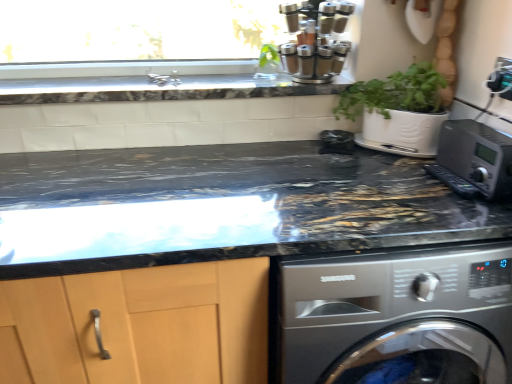
Describe the element at coordinates (315, 40) in the screenshot. The width and height of the screenshot is (512, 384). I see `satin silver spice rack at upper center` at that location.

Describe the element at coordinates (223, 206) in the screenshot. The height and width of the screenshot is (384, 512). I see `marble at center, positioned as the first countertop in bottom-to-top order` at that location.

At what (x,y) coordinates should I click in order to perform the action: click on black marble countertop at upper center, which is the first countertop from top to bottom. Please return your answer as a coordinate pair (x, y). Looking at the image, I should click on (156, 89).

In terms of width, does metallic silver microwave at right look wider or thinner when compared to black marble countertop at upper center, which is the first countertop from top to bottom?

Clearly, metallic silver microwave at right has less width compared to black marble countertop at upper center, which is the first countertop from top to bottom.

At what (x,y) coordinates should I click in order to perform the action: click on home appliance that is below the black marble countertop at upper center, which is the first countertop from top to bottom (from the image's perspective). Please return your answer as a coordinate pair (x, y). Looking at the image, I should click on (474, 160).

Considering the relative sizes of metallic silver microwave at right and black marble countertop at upper center, marked as the 2th countertop in a bottom-to-top arrangement, in the image provided, is metallic silver microwave at right bigger than black marble countertop at upper center, marked as the 2th countertop in a bottom-to-top arrangement,?

No.

Looking at their sizes, would you say marble at center, which is the 2th countertop in top-to-bottom order, is wider or thinner than black marble countertop at upper center, marked as the 2th countertop in a bottom-to-top arrangement?

In the image, marble at center, which is the 2th countertop in top-to-bottom order, appears to be wider than black marble countertop at upper center, marked as the 2th countertop in a bottom-to-top arrangement.

Could you tell me if marble at center, positioned as the first countertop in bottom-to-top order, is facing black marble countertop at upper center, marked as the 2th countertop in a bottom-to-top arrangement?

No, marble at center, positioned as the first countertop in bottom-to-top order, is not turned towards black marble countertop at upper center, marked as the 2th countertop in a bottom-to-top arrangement.

Looking at the image, does marble at center, positioned as the first countertop in bottom-to-top order, seem bigger or smaller compared to black marble countertop at upper center, which is the first countertop from top to bottom?

Considering their sizes, marble at center, positioned as the first countertop in bottom-to-top order, takes up more space than black marble countertop at upper center, which is the first countertop from top to bottom.

Considering the positions of point (499, 218) and point (20, 98), is point (499, 218) closer or farther from the camera than point (20, 98)?

Point (499, 218).

Is marble at center, which is the 2th countertop in top-to-bottom order, to the right of satin silver spice rack at upper center from the viewer's perspective?

No.

Is marble at center, positioned as the first countertop in bottom-to-top order, oriented towards satin silver spice rack at upper center?

No, marble at center, positioned as the first countertop in bottom-to-top order, is not turned towards satin silver spice rack at upper center.

Which is less distant, (x=230, y=166) or (x=301, y=36)?

Point (x=230, y=166)

Is marble at center, positioned as the first countertop in bottom-to-top order, bigger than satin silver spice rack at upper center?

Yes, marble at center, positioned as the first countertop in bottom-to-top order, is bigger than satin silver spice rack at upper center.

Between metallic silver microwave at right and marble at center, positioned as the first countertop in bottom-to-top order, which one is positioned in front?

marble at center, positioned as the first countertop in bottom-to-top order.

From the image's perspective, would you say metallic silver microwave at right is positioned over marble at center, positioned as the first countertop in bottom-to-top order?

Yes, from the image's perspective, metallic silver microwave at right is over marble at center, positioned as the first countertop in bottom-to-top order.

Considering the points (490, 195) and (297, 197), which point is behind, point (490, 195) or point (297, 197)?

The point (297, 197) is more distant.

Does metallic silver microwave at right turn towards marble at center, which is the 2th countertop in top-to-bottom order?

No.

Which is more to the left, green leafy plant at upper center or satin silver spice rack at upper center?

From the viewer's perspective, green leafy plant at upper center appears more on the left side.

You are a GUI agent. You are given a task and a screenshot of the screen. Output one action in this format:
    pyautogui.click(x=<x>, y=<y>)
    Task: Click on the plant below the satin silver spice rack at upper center (from a real-world perspective)
    This screenshot has width=512, height=384.
    Given the screenshot: What is the action you would take?
    pyautogui.click(x=268, y=55)

From the image's perspective, between green leafy plant at upper center and satin silver spice rack at upper center, which one is located above?

satin silver spice rack at upper center appears higher in the image.

Considering the relative positions of green leafy plant at upper center and metallic silver microwave at right in the image provided, is green leafy plant at upper center behind metallic silver microwave at right?

Yes, green leafy plant at upper center is further from the camera.

Between green leafy plant at upper center and metallic silver microwave at right, which one has smaller size?

With smaller size is green leafy plant at upper center.

Considering the relative sizes of green leafy plant at upper center and metallic silver microwave at right in the image provided, is green leafy plant at upper center wider than metallic silver microwave at right?

No.

How many degrees apart are the facing directions of green leafy plant at upper center and metallic silver microwave at right?

The facing directions of green leafy plant at upper center and metallic silver microwave at right are 90 degrees apart.

From a real-world perspective, which is physically above, metallic silver microwave at right or green leafy plant at upper center?

green leafy plant at upper center, from a real-world perspective.

Is metallic silver microwave at right looking in the opposite direction of green leafy plant at upper center?

No, metallic silver microwave at right is not facing away from green leafy plant at upper center.

I want to click on countertop located above the metallic silver microwave at right (from the image's perspective), so click(156, 89).

Find the location of `countertop lying below the black marble countertop at upper center, marked as the 2th countertop in a bottom-to-top arrangement (from the image's perspective)`. countertop lying below the black marble countertop at upper center, marked as the 2th countertop in a bottom-to-top arrangement (from the image's perspective) is located at coordinates (223, 206).

When comparing their distances from metallic silver microwave at right, does green leafy plant at upper center or black marble countertop at upper center, marked as the 2th countertop in a bottom-to-top arrangement, seem further?

green leafy plant at upper center.

When comparing their distances from satin silver spice rack at upper center, does green leafy plant at upper center or marble at center, which is the 2th countertop in top-to-bottom order, seem further?

marble at center, which is the 2th countertop in top-to-bottom order.

Considering their positions, is green leafy plant at upper center positioned closer to satin silver spice rack at upper center than metallic silver microwave at right?

green leafy plant at upper center is positioned closer to the anchor satin silver spice rack at upper center.

Considering their positions, is metallic silver microwave at right positioned further to black marble countertop at upper center, which is the first countertop from top to bottom, than marble at center, positioned as the first countertop in bottom-to-top order?

metallic silver microwave at right.

Estimate the real-world distances between objects in this image. Which object is closer to green leafy plant at upper center, marble at center, positioned as the first countertop in bottom-to-top order, or metallic silver microwave at right?

marble at center, positioned as the first countertop in bottom-to-top order.

From the picture: Considering their positions, is satin silver spice rack at upper center positioned further to metallic silver microwave at right than marble at center, positioned as the first countertop in bottom-to-top order?

Among the two, satin silver spice rack at upper center is located further to metallic silver microwave at right.

Which object lies further to the anchor point marble at center, positioned as the first countertop in bottom-to-top order, black marble countertop at upper center, which is the first countertop from top to bottom, or green leafy plant at upper center?

The object further to marble at center, positioned as the first countertop in bottom-to-top order, is green leafy plant at upper center.

From the image, which object appears to be farther from metallic silver microwave at right, marble at center, positioned as the first countertop in bottom-to-top order, or green leafy plant at upper center?

green leafy plant at upper center.

Identify the location of coffee machine between marble at center, positioned as the first countertop in bottom-to-top order, and metallic silver microwave at right from left to right. (315, 40).

I want to click on plant situated between marble at center, which is the 2th countertop in top-to-bottom order, and metallic silver microwave at right from left to right, so click(268, 55).

I want to click on coffee machine between green leafy plant at upper center and metallic silver microwave at right from left to right, so click(315, 40).

You are a GUI agent. You are given a task and a screenshot of the screen. Output one action in this format:
    pyautogui.click(x=<x>, y=<y>)
    Task: Click on the countertop between satin silver spice rack at upper center and marble at center, which is the 2th countertop in top-to-bottom order, vertically
    
    Given the screenshot: What is the action you would take?
    pyautogui.click(x=156, y=89)